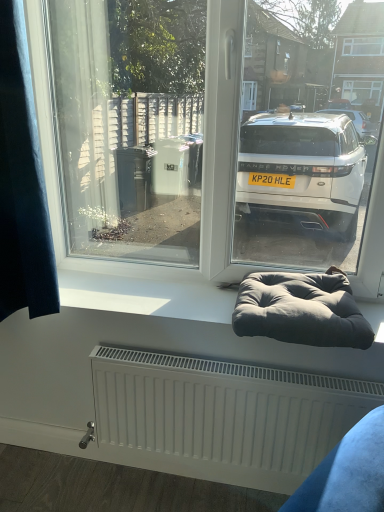
Question: Is dark blue fabric at left located outside dark gray fabric bean bag at lower center?

Choices:
 (A) yes
 (B) no

Answer: (A)

Question: Could you tell me if dark blue fabric at left is turned towards dark gray fabric bean bag at lower center?

Choices:
 (A) yes
 (B) no

Answer: (B)

Question: From the image's perspective, is dark blue fabric at left below dark gray fabric bean bag at lower center?

Choices:
 (A) no
 (B) yes

Answer: (A)

Question: Is dark blue fabric at left facing away from dark gray fabric bean bag at lower center?

Choices:
 (A) yes
 (B) no

Answer: (B)

Question: Is dark gray fabric bean bag at lower center located within dark blue fabric at left?

Choices:
 (A) yes
 (B) no

Answer: (B)

Question: Is dark blue fabric at left bigger than dark gray fabric bean bag at lower center?

Choices:
 (A) yes
 (B) no

Answer: (A)

Question: From a real-world perspective, is white matte window sill at center located beneath dark gray fabric bean bag at lower center?

Choices:
 (A) yes
 (B) no

Answer: (A)

Question: From a real-world perspective, is white matte window sill at center positioned over dark gray fabric bean bag at lower center based on gravity?

Choices:
 (A) yes
 (B) no

Answer: (B)

Question: Is white matte window sill at center positioned in front of dark gray fabric bean bag at lower center?

Choices:
 (A) yes
 (B) no

Answer: (B)

Question: Can you confirm if white matte window sill at center is wider than dark gray fabric bean bag at lower center?

Choices:
 (A) no
 (B) yes

Answer: (A)

Question: Does white matte window sill at center turn towards dark gray fabric bean bag at lower center?

Choices:
 (A) no
 (B) yes

Answer: (A)

Question: Is dark gray fabric bean bag at lower center inside white matte window sill at center?

Choices:
 (A) yes
 (B) no

Answer: (B)

Question: From the image's perspective, is white matte window sill at center above dark blue fabric at left?

Choices:
 (A) no
 (B) yes

Answer: (A)